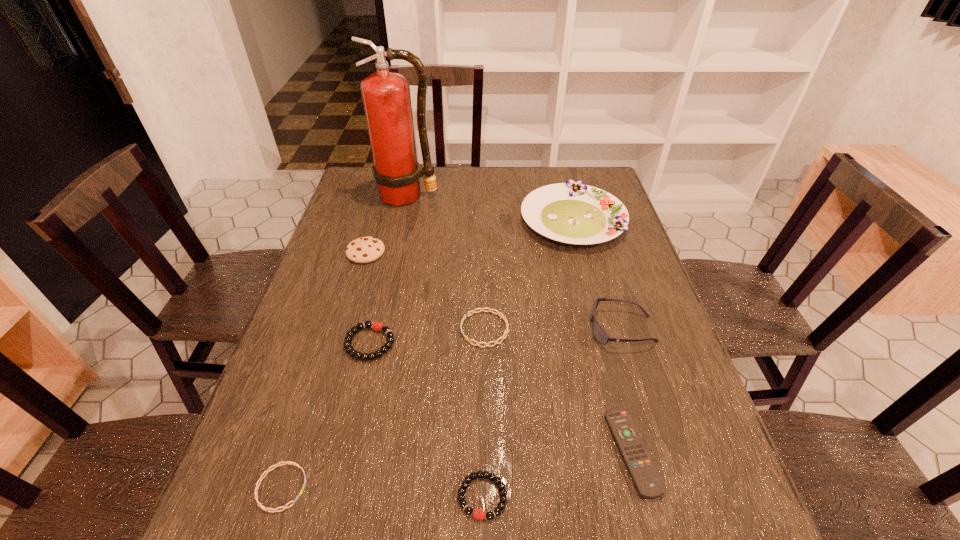
The height and width of the screenshot is (540, 960). In order to click on the right black bracelet in this screenshot , I will do `click(478, 514)`.

Identify the location of the nearer black bracelet. (478, 514).

The height and width of the screenshot is (540, 960). Find the location of `remote control`. remote control is located at coordinates (641, 467).

What are the coordinates of `the left blue bracelet` in the screenshot? It's located at (286, 462).

Locate an element on the screen. The height and width of the screenshot is (540, 960). the shortest bracelet is located at coordinates (286, 462).

Locate an element on the screen. This screenshot has width=960, height=540. free space located at the nozzle of the tallest object is located at coordinates (396, 245).

Identify the location of vacant space positioned 0.350m on the front of the salad plate. (607, 349).

Identify the location of free point located 0.200m on the lenses of the sunglasses. The width and height of the screenshot is (960, 540). (509, 328).

Locate an element on the screen. This screenshot has height=540, width=960. free point located 0.100m on the lenses of the sunglasses is located at coordinates (549, 328).

Image resolution: width=960 pixels, height=540 pixels. What are the coordinates of `vacant area situated 0.120m on the lenses of the sunglasses` in the screenshot? It's located at (541, 328).